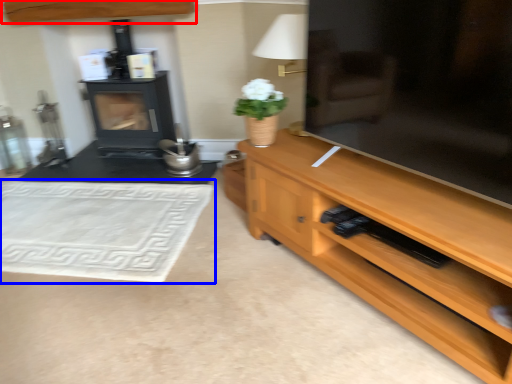
Question: Among these objects, which one is farthest to the camera, cabinetry (highlighted by a red box) or mat (highlighted by a blue box)?

Choices:
 (A) cabinetry
 (B) mat

Answer: (A)